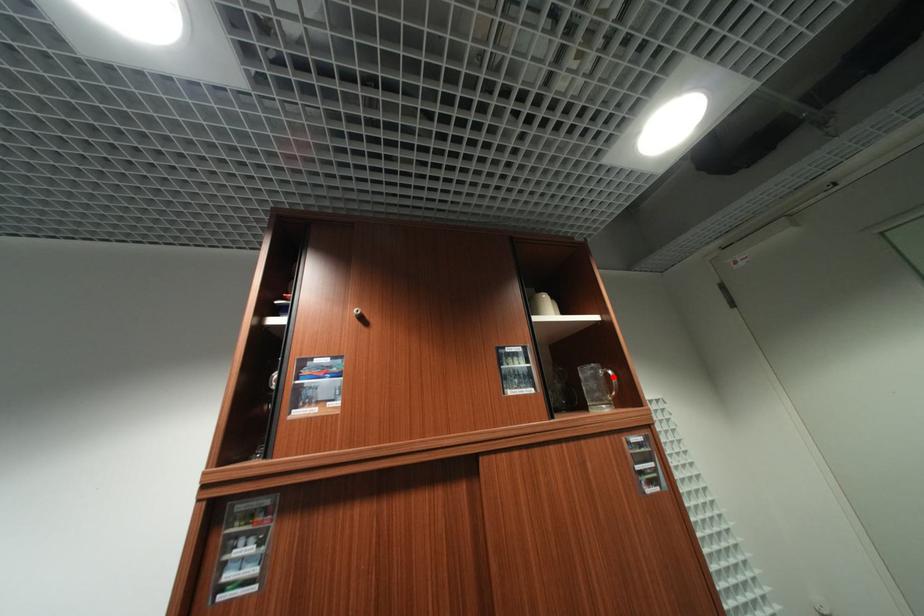
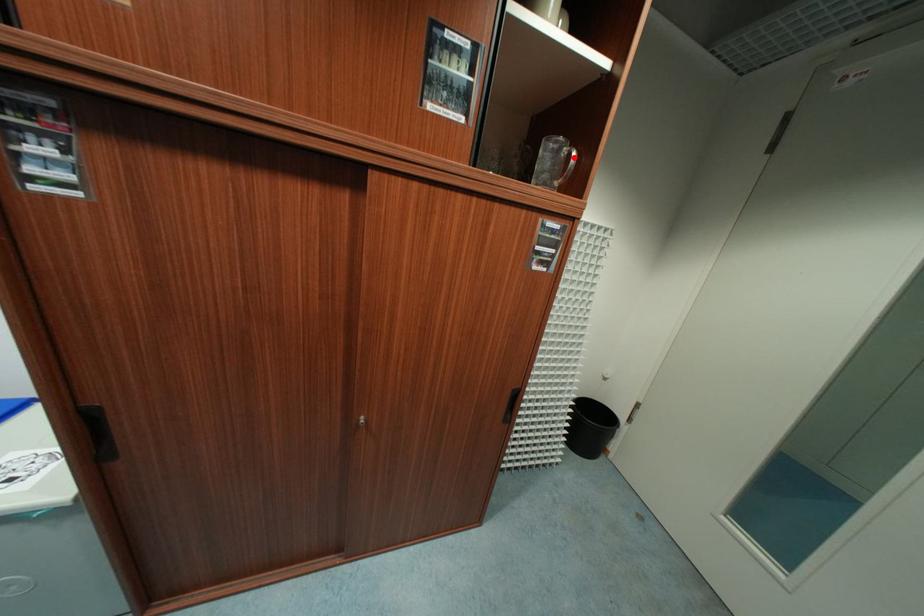
I am providing you with two images of the same scene from different viewpoints. A red point is marked on the first image and another point is marked on the second image. Does the point marked in image1 correspond to the same location as the one in image2?

Yes